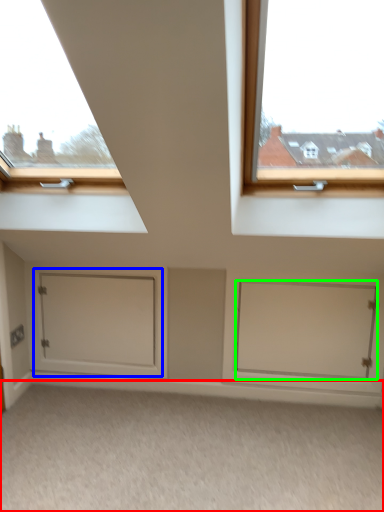
Question: Which object is positioned closest to plain (highlighted by a red box)? Select from door (highlighted by a blue box) and door (highlighted by a green box).

Choices:
 (A) door
 (B) door

Answer: (B)